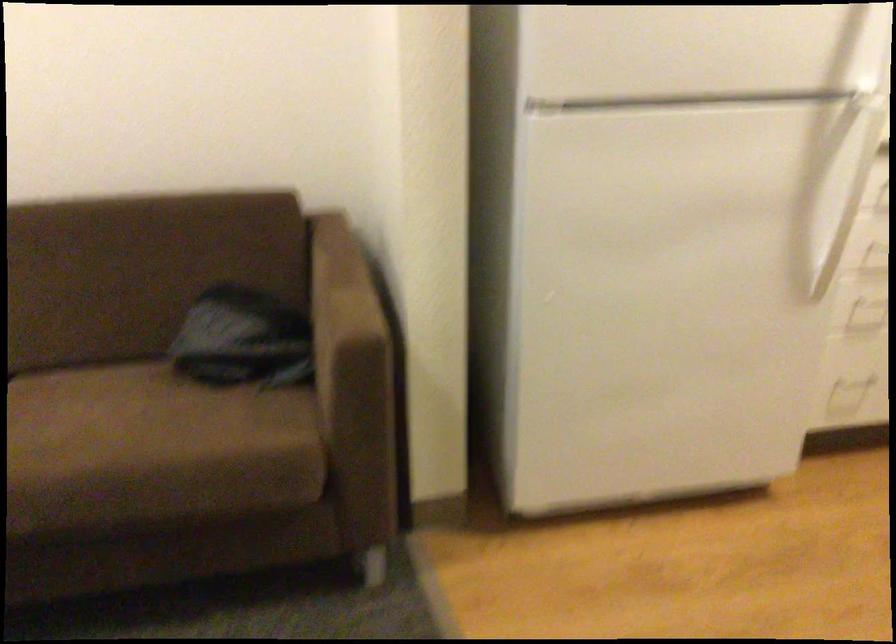
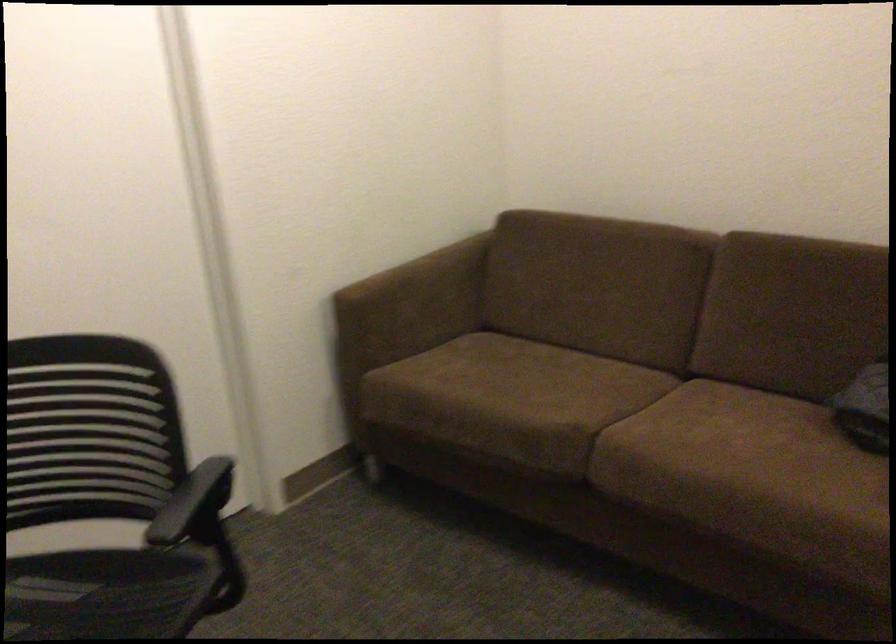
In the second image, find the point that corresponds to pixel 106 455 in the first image.

(726, 462)